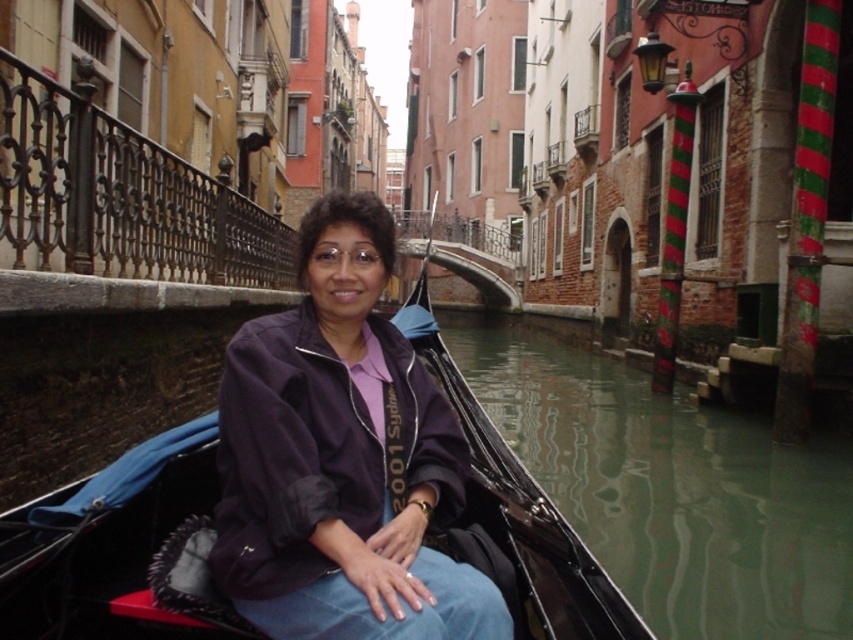
Who is more forward, (230, 497) or (714, 632)?

Point (230, 497) is more forward.

At what (x,y) coordinates should I click in order to perform the action: click on dark purple jacket at center. Please return your answer as a coordinate pair (x, y). The height and width of the screenshot is (640, 853). Looking at the image, I should click on point(341,458).

Can you confirm if green reflective water at lower center is positioned below black leather boat at center?

Incorrect, green reflective water at lower center is not positioned below black leather boat at center.

Is green reflective water at lower center closer to the viewer compared to black leather boat at center?

No, green reflective water at lower center is further to the viewer.

Between point (556, 352) and point (134, 520), which one is positioned behind?

The point (556, 352) is behind.

At what (x,y) coordinates should I click in order to perform the action: click on green reflective water at lower center. Please return your answer as a coordinate pair (x, y). This screenshot has width=853, height=640. Looking at the image, I should click on (672, 488).

Does dark purple jacket at center have a lesser height compared to black leather boat at center?

Correct, dark purple jacket at center is not as tall as black leather boat at center.

Does dark purple jacket at center have a greater width compared to black leather boat at center?

No.

Who is more distant from viewer, (x=393, y=340) or (x=86, y=580)?

Point (x=393, y=340)

Find the location of a particular element. dark purple jacket at center is located at coordinates (341, 458).